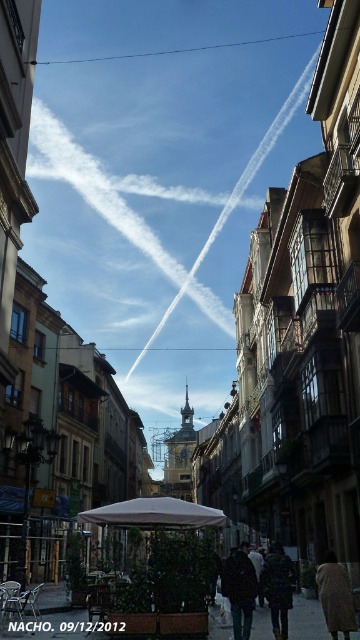
You are a photographer standing at the end of the narrow street scene and want to capture the dark brown leather jacket at center in your shot. Given that your camera has a maximum zoom range of 100 feet, will you be able to focus on the jacket without moving closer?

The dark brown leather jacket at center is 198.61 feet away from the camera. Since your camera can only zoom up to 100 feet, you won cannot focus on the jacket without moving closer.

You are standing at the center of the street in the European city scene. You see a brown fabric coat at lower right. Can you estimate its position relative to the center of the image using coordinates from 0 to 1?

Answer: The brown fabric coat at lower right is located at coordinates approximately 0.933 on both the x and y axes, meaning it is positioned near the lower right corner of the image.

You are a delivery person carrying a package that requires a minimum of 4 meters of space to maneuver safely. You need to pass between the dark brown leather jacket at center and the dark gray wool coat at center. Is there enough space for you to pass safely?

The dark brown leather jacket at center is 3.95 meters from dark gray wool coat at center, which is less than the required 4 meters. Therefore, there is not enough space to pass safely between them.